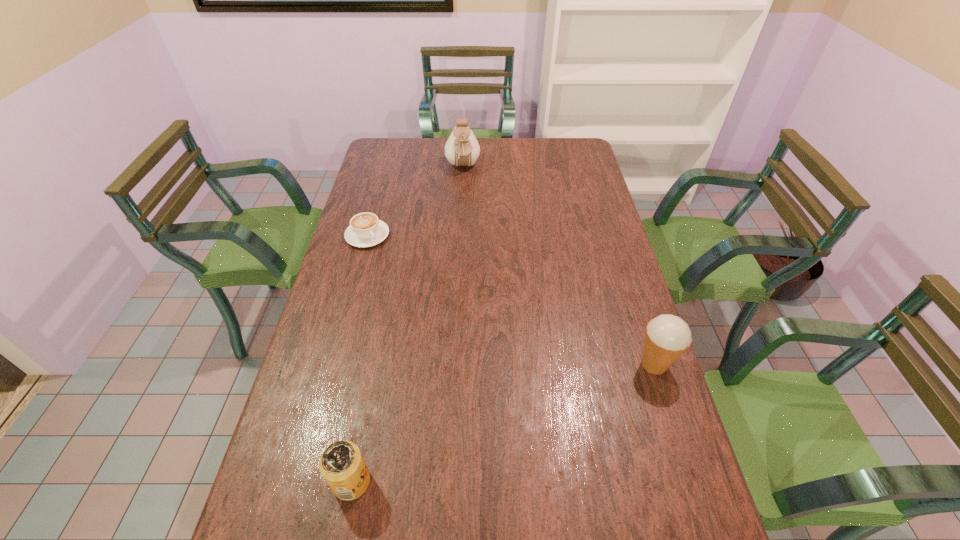
I want to click on vacant space that is in between the third tallest object and the third nearest object, so click(x=360, y=359).

In order to click on vacant area that lies between the beer can and the second farthest object in this screenshot , I will do `click(360, 359)`.

Locate an element on the screen. vacant space in between the cappuccino and the third object from left to right is located at coordinates (415, 201).

This screenshot has height=540, width=960. I want to click on free spot between the icecream and the pouch, so click(559, 266).

Find the location of a particular element. The height and width of the screenshot is (540, 960). free area in between the nearest object and the rightmost object is located at coordinates [x=503, y=423].

Image resolution: width=960 pixels, height=540 pixels. I want to click on free spot between the farthest object and the icecream, so click(559, 266).

This screenshot has height=540, width=960. What are the coordinates of `vacant area between the nearest object and the icecream` in the screenshot? It's located at (503, 423).

The width and height of the screenshot is (960, 540). Find the location of `the closest object relative to the third farthest object`. the closest object relative to the third farthest object is located at coordinates (342, 465).

Locate which object ranks second in proximity to the nearest object. Please provide its 2D coordinates. Your answer should be formatted as a tuple, i.e. [(x, y)], where the tuple contains the x and y coordinates of a point satisfying the conditions above.

[(365, 230)]

Locate an element on the screen. The width and height of the screenshot is (960, 540). vacant region that satisfies the following two spatial constraints: 1. on the back side of the second farthest object; 2. on the right side of the second object from right to left is located at coordinates (386, 167).